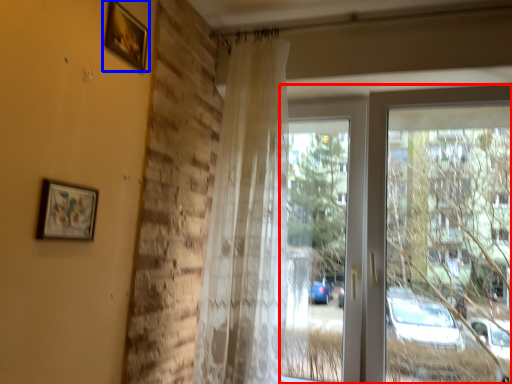
Question: Which of the following is the farthest to the observer, window (highlighted by a red box) or picture frame (highlighted by a blue box)?

Choices:
 (A) window
 (B) picture frame

Answer: (A)